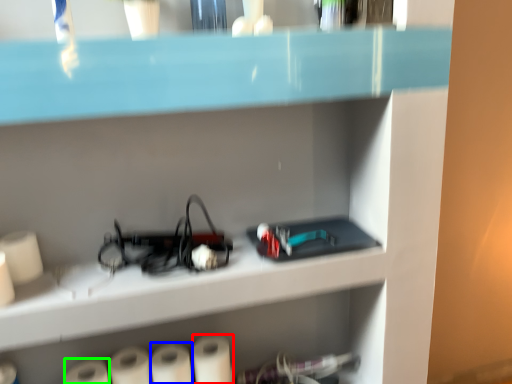
Question: Which is nearer to the paper towel (highlighted by a red box)? paper towel (highlighted by a blue box) or paper towel (highlighted by a green box).

Choices:
 (A) paper towel
 (B) paper towel

Answer: (A)